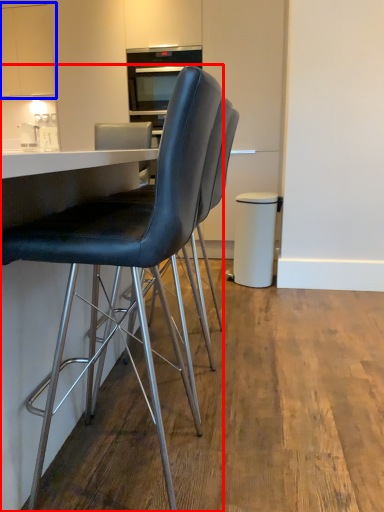
Question: Which object appears farthest to the camera in this image, chair (highlighted by a red box) or cabinetry (highlighted by a blue box)?

Choices:
 (A) chair
 (B) cabinetry

Answer: (B)